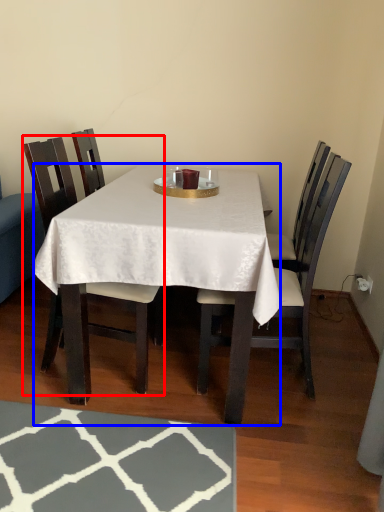
Question: Among these objects, which one is nearest to the camera, chair (highlighted by a red box) or desk (highlighted by a blue box)?

Choices:
 (A) chair
 (B) desk

Answer: (B)